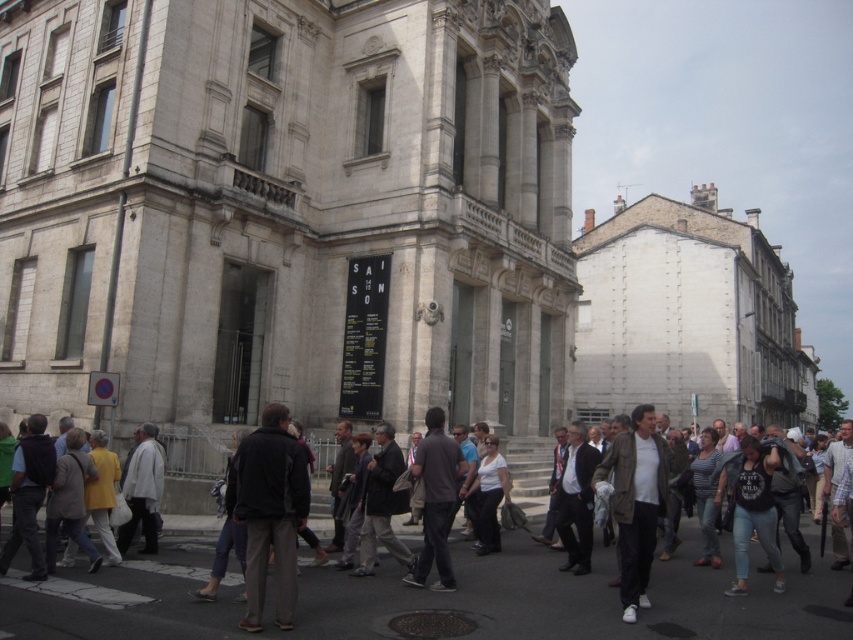
Question: Which of the following is the farthest from the observer?

Choices:
 (A) (398, 502)
 (B) (619, 497)

Answer: (A)

Question: Is light yellow jacket at center wider than brown fabric shirt at center?

Choices:
 (A) no
 (B) yes

Answer: (B)

Question: Can you confirm if light brown leather jacket at center is wider than light yellow jacket at center?

Choices:
 (A) yes
 (B) no

Answer: (A)

Question: Which of the following is the closest to the observer?

Choices:
 (A) (292, 536)
 (B) (651, 484)

Answer: (A)

Question: Estimate the real-world distances between objects in this image. Which object is closer to the dark gray jacket at center?

Choices:
 (A) light brown leather jacket at center
 (B) light yellow jacket at center
 (C) brown fabric shirt at center

Answer: (C)

Question: Is light yellow jacket at center closer to camera compared to dark gray jacket at center?

Choices:
 (A) yes
 (B) no

Answer: (A)